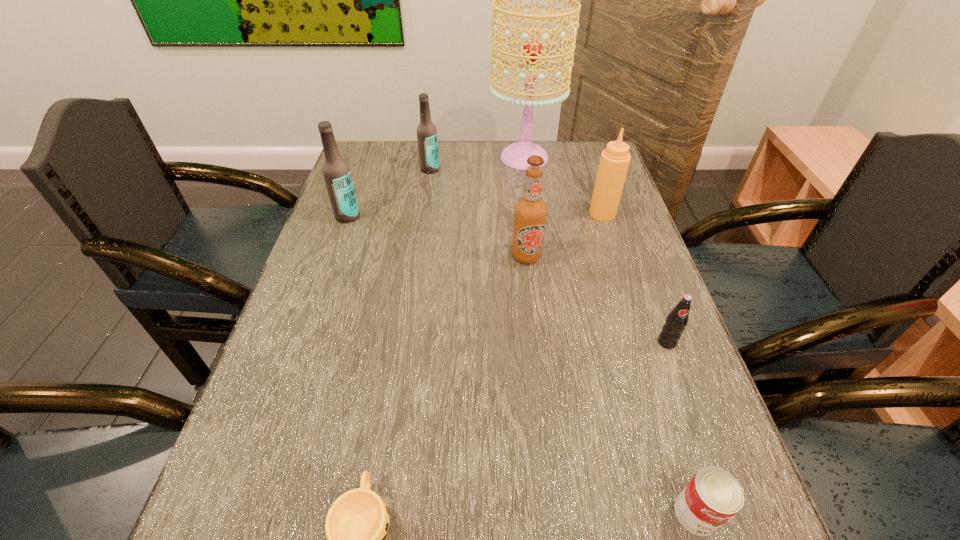
This screenshot has height=540, width=960. I want to click on vacant space at the far right corner of the desktop, so click(x=572, y=168).

This screenshot has width=960, height=540. In order to click on vacant space in between the rightmost beer bottle and the third shortest object in this screenshot , I will do `click(596, 299)`.

You are a GUI agent. You are given a task and a screenshot of the screen. Output one action in this format:
    pyautogui.click(x=<x>, y=<y>)
    Task: Click on the free spot between the nearest beer bottle and the pop
    
    Given the screenshot: What is the action you would take?
    [596, 299]

This screenshot has width=960, height=540. I want to click on blank region between the fifth farthest object and the condiment, so click(564, 235).

This screenshot has width=960, height=540. In order to click on empty location between the tallest object and the second nearest beer bottle in this screenshot , I will do `click(436, 187)`.

The width and height of the screenshot is (960, 540). What are the coordinates of `empty space that is in between the second shortest object and the second beer bottle from left to right` in the screenshot? It's located at (563, 341).

What are the coordinates of `free space that is in between the second beer bottle from left to right and the tallest object` in the screenshot? It's located at (477, 164).

The height and width of the screenshot is (540, 960). What are the coordinates of `vacant space that is in between the leftmost object and the lampshade` in the screenshot? It's located at (436, 187).

Identify the location of free area in between the condiment and the second beer bottle from right to left. This screenshot has width=960, height=540. (516, 192).

Identify which object is located as the nearest to the third shortest object. Please provide its 2D coordinates. Your answer should be formatted as a tuple, i.e. [(x, y)], where the tuple contains the x and y coordinates of a point satisfying the conditions above.

[(713, 496)]